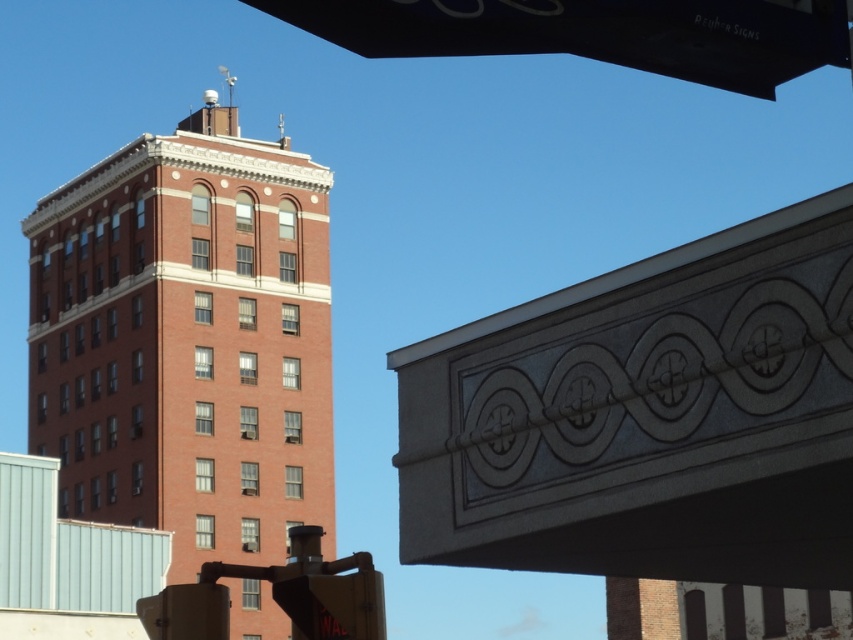
You are a pedestrian standing at the crosswalk and see the black plastic street sign at upper center and the metallic yellow traffic light at lower center. Which object is closer to you?

The black plastic street sign at upper center is closer to you because it is further to the viewer than the metallic yellow traffic light at lower center.

You are driving a car and need to read both the black plastic street sign at upper center and the metallic yellow traffic light at lower center. Which object will you see first as you approach the intersection?

The black plastic street sign at upper center will be seen first because it is larger in size than the metallic yellow traffic light at lower center, making it more visible from a distance.